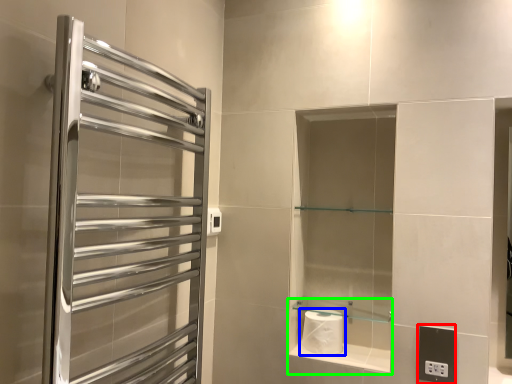
Question: Which is farther away from electric outlet (highlighted by a red box)? toilet paper (highlighted by a blue box) or cabinet (highlighted by a green box)?

Choices:
 (A) toilet paper
 (B) cabinet

Answer: (A)